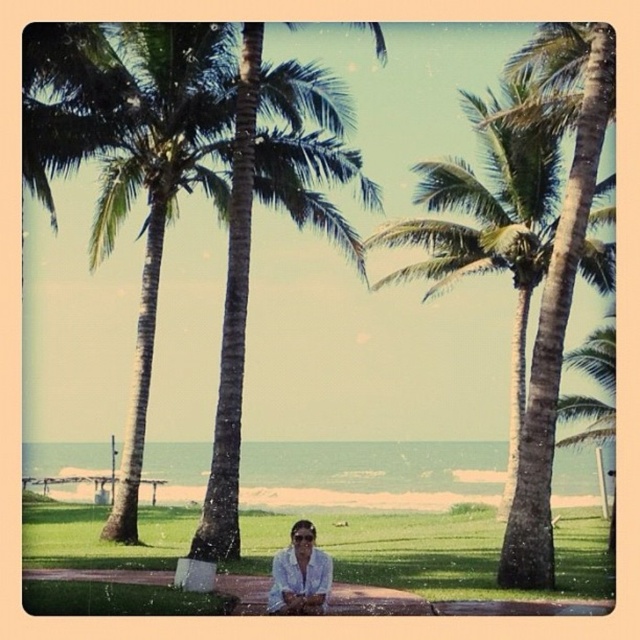
You are standing at the beach and want to place a 10 meter long banner between the green leafy palm tree at center and the white matte shirt at lower center. Can you fit the banner between them?

The distance between the green leafy palm tree at center and the white matte shirt at lower center is 9.91 meters, so the 10 meter long banner would be too long to fit between them.

You are standing at the center of the lawn in the tropical scene. You see a green leafy palm tree at right located at point (490, 227). If you walk straight towards the ocean, will you pass by the green leafy palm tree at right before reaching the ocean?

The green leafy palm tree at right is located at point (490, 227). Since you are starting at the center of the lawn and walking straight towards the ocean, which is in the background, the palm tree at that coordinate is positioned to the right side of the scene. Therefore, walking straight towards the ocean would not pass by the green leafy palm tree at right, as it is off to the side rather than directly in your path.

You are a photographer standing at the beach. You want to take a photo of the green leafy palm tree at right and the white matte shirt at lower center in the same frame. Can you position yourself so that both are visible without moving either object? Explain why or why not.

The green leafy palm tree at right and white matte shirt at lower center are 20.48 meters apart. Since the distance between them is significant, positioning yourself at a vantage point that can capture both in the same frame would depend on the camera lens used. A wide angle lens could potentially include both, but if using a standard lens, you might need to step back further to ensure both are in view. However, given the distance, it might be challenging without zooming out or adjusting the camera angle.